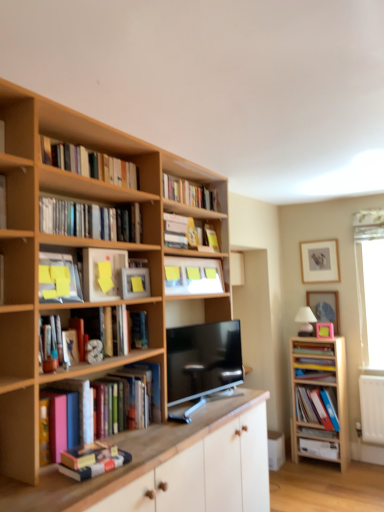
You are a GUI agent. You are given a task and a screenshot of the screen. Output one action in this format:
    pyautogui.click(x=<x>, y=<y>)
    Task: Click on the free space in front of hardcover book at lower left, which is counted as the 5th book, starting from the bottom
    The image size is (384, 512).
    Given the screenshot: What is the action you would take?
    pyautogui.click(x=71, y=486)